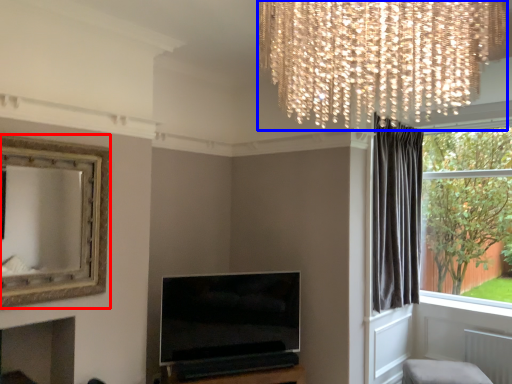
Question: Which object is closer to the camera taking this photo, picture frame (highlighted by a red box) or lamp (highlighted by a blue box)?

Choices:
 (A) picture frame
 (B) lamp

Answer: (B)